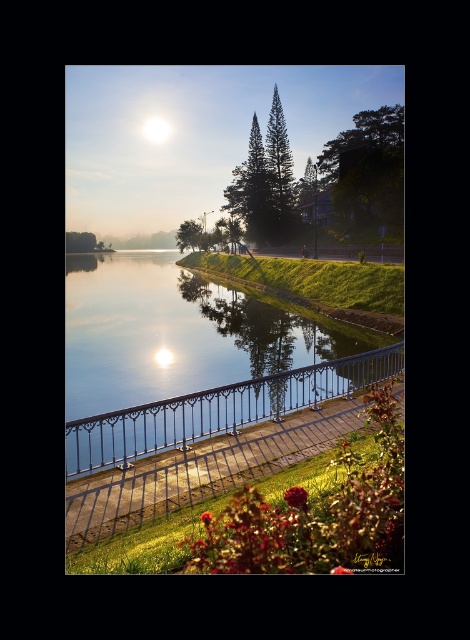
You are a landscape architect designing a walking path that needs to pass between the black wrought iron railing at lower center and the white glossy moonlight at upper center. What is the minimum width required for the path to ensure it can fit between them?

The distance between the black wrought iron railing at lower center and the white glossy moonlight at upper center is 397.59 meters. Therefore, the path must be at least 397.59 meters wide to fit between them.

You are standing at the edge of the lakeside and see the point marked at coordinates (219, 410). According to the image, where exactly is this point located?

The point at coordinates (219, 410) is located on the black wrought iron railing at lower center.